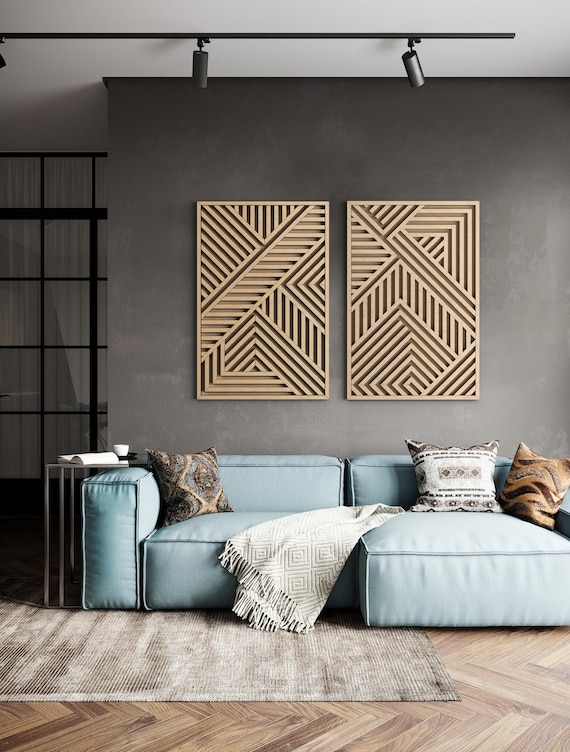
Locate an element on the screen. This screenshot has width=570, height=752. light blue love seat is located at coordinates (268, 489).